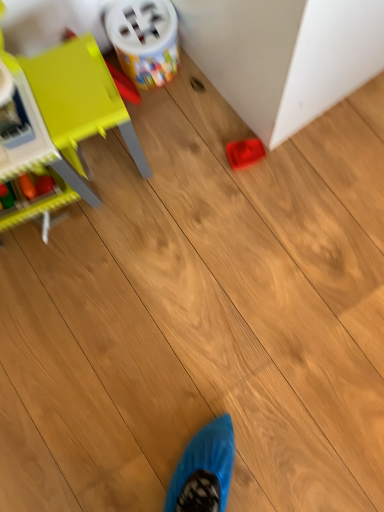
Measure the distance between matte yellow chair at left, which is the 3th toy in right-to-left order, and camera.

matte yellow chair at left, which is the 3th toy in right-to-left order, is 82.23 centimeters from camera.

How much space does matte plastic tray at center-right, the 3th toy when ordered from left to right, occupy horizontally?

matte plastic tray at center-right, the 3th toy when ordered from left to right, is 2.79 inches wide.

What do you see at coordinates (145, 40) in the screenshot? I see `plastic container at upper center, arranged as the second toy when viewed from the right` at bounding box center [145, 40].

Identify the location of matte yellow chair at left, which is the 3th toy in right-to-left order. (29, 132).

From the image's perspective, does matte plastic tray at center-right, the 3th toy when ordered from left to right, appear lower than matte yellow chair at left, which is the 3th toy in right-to-left order?

Actually, matte plastic tray at center-right, the 3th toy when ordered from left to right, appears above matte yellow chair at left, which is the 3th toy in right-to-left order, in the image.

Is matte plastic tray at center-right, arranged as the first toy when viewed from the right, looking in the opposite direction of matte yellow chair at left, the 1th toy in the left-to-right sequence?

matte plastic tray at center-right, arranged as the first toy when viewed from the right, is not turned away from matte yellow chair at left, the 1th toy in the left-to-right sequence.

What's the angular difference between matte plastic tray at center-right, the 3th toy when ordered from left to right, and matte yellow chair at left, the 1th toy in the left-to-right sequence,'s facing directions?

7.01 degrees separate the facing orientations of matte plastic tray at center-right, the 3th toy when ordered from left to right, and matte yellow chair at left, the 1th toy in the left-to-right sequence.

Is the depth of matte plastic tray at center-right, arranged as the first toy when viewed from the right, greater than that of matte yellow chair at left, the 1th toy in the left-to-right sequence?

Yes, matte plastic tray at center-right, arranged as the first toy when viewed from the right, is behind matte yellow chair at left, the 1th toy in the left-to-right sequence.

From a real-world perspective, who is located lower, matte yellow chair at left, the 1th toy in the left-to-right sequence, or matte plastic tray at center-right, the 3th toy when ordered from left to right?

From a 3D spatial view, matte plastic tray at center-right, the 3th toy when ordered from left to right, is below.

Does matte yellow chair at left, which is the 3th toy in right-to-left order, have a lesser height compared to matte plastic tray at center-right, arranged as the first toy when viewed from the right?

Incorrect, the height of matte yellow chair at left, which is the 3th toy in right-to-left order, does not fall short of that of matte plastic tray at center-right, arranged as the first toy when viewed from the right.

Which of these two, matte yellow chair at left, which is the 3th toy in right-to-left order, or matte plastic tray at center-right, arranged as the first toy when viewed from the right, is thinner?

With smaller width is matte plastic tray at center-right, arranged as the first toy when viewed from the right.

Between plastic container at upper center, arranged as the second toy when viewed from the right, and matte plastic tray at center-right, the 3th toy when ordered from left to right, which one appears on the left side from the viewer's perspective?

plastic container at upper center, arranged as the second toy when viewed from the right, is more to the left.

Is plastic container at upper center, acting as the second toy starting from the left, outside of matte plastic tray at center-right, arranged as the first toy when viewed from the right?

plastic container at upper center, acting as the second toy starting from the left, is positioned outside matte plastic tray at center-right, arranged as the first toy when viewed from the right.

From a real-world perspective, does plastic container at upper center, acting as the second toy starting from the left, sit lower than matte plastic tray at center-right, the 3th toy when ordered from left to right?

No, from a real-world perspective, plastic container at upper center, acting as the second toy starting from the left, is not beneath matte plastic tray at center-right, the 3th toy when ordered from left to right.

Is plastic container at upper center, arranged as the second toy when viewed from the right, next to matte plastic tray at center-right, the 3th toy when ordered from left to right?

plastic container at upper center, arranged as the second toy when viewed from the right, and matte plastic tray at center-right, the 3th toy when ordered from left to right, are clearly separated.

Which object is positioned more to the left, matte yellow chair at left, which is the 3th toy in right-to-left order, or plastic container at upper center, arranged as the second toy when viewed from the right?

From the viewer's perspective, matte yellow chair at left, which is the 3th toy in right-to-left order, appears more on the left side.

Who is smaller, matte yellow chair at left, which is the 3th toy in right-to-left order, or plastic container at upper center, acting as the second toy starting from the left?

plastic container at upper center, acting as the second toy starting from the left, is smaller.

Considering the points (29, 165) and (166, 62), which point is behind, point (29, 165) or point (166, 62)?

The point (166, 62) is more distant.

Where is `toy lying in front of the plastic container at upper center, arranged as the second toy when viewed from the right`? This screenshot has width=384, height=512. toy lying in front of the plastic container at upper center, arranged as the second toy when viewed from the right is located at coordinates (29, 132).

Is rubberized red tray at lower right in front of or behind matte yellow chair at left, which is the 3th toy in right-to-left order, in the image?

Visually, rubberized red tray at lower right is located behind matte yellow chair at left, which is the 3th toy in right-to-left order.

Which is more to the left, rubberized red tray at lower right or matte yellow chair at left, which is the 3th toy in right-to-left order?

Positioned to the left is matte yellow chair at left, which is the 3th toy in right-to-left order.

Who is smaller, rubberized red tray at lower right or matte yellow chair at left, the 1th toy in the left-to-right sequence?

Smaller between the two is matte yellow chair at left, the 1th toy in the left-to-right sequence.

Does point (276, 62) lie behind point (1, 170)?

No, (276, 62) is in front of (1, 170).

How distant is matte plastic tray at center-right, arranged as the first toy when viewed from the right, from rubberized red tray at lower right?

The distance of matte plastic tray at center-right, arranged as the first toy when viewed from the right, from rubberized red tray at lower right is 10.49 inches.

From the image's perspective, is matte plastic tray at center-right, the 3th toy when ordered from left to right, positioned above or below rubberized red tray at lower right?

Based on their image positions, matte plastic tray at center-right, the 3th toy when ordered from left to right, is located beneath rubberized red tray at lower right.

Is matte plastic tray at center-right, arranged as the first toy when viewed from the right, placed right next to rubberized red tray at lower right?

No, matte plastic tray at center-right, arranged as the first toy when viewed from the right, is not next to rubberized red tray at lower right.

Would you say matte plastic tray at center-right, arranged as the first toy when viewed from the right, is inside or outside rubberized red tray at lower right?

matte plastic tray at center-right, arranged as the first toy when viewed from the right, cannot be found inside rubberized red tray at lower right.

Is the position of rubberized red tray at lower right more distant than that of plastic container at upper center, arranged as the second toy when viewed from the right?

No, rubberized red tray at lower right is closer to the camera.

Do you think rubberized red tray at lower right is within plastic container at upper center, acting as the second toy starting from the left, or outside of it?

rubberized red tray at lower right is outside plastic container at upper center, acting as the second toy starting from the left.

From the image's perspective, relative to plastic container at upper center, acting as the second toy starting from the left, is rubberized red tray at lower right above or below?

Based on their image positions, rubberized red tray at lower right is located above plastic container at upper center, acting as the second toy starting from the left.

From a real-world perspective, is rubberized red tray at lower right located beneath plastic container at upper center, acting as the second toy starting from the left?

Incorrect, from a real-world perspective, rubberized red tray at lower right is higher than plastic container at upper center, acting as the second toy starting from the left.

From the image's perspective, which toy is the 1st one above the matte yellow chair at left, which is the 3th toy in right-to-left order? Please provide its 2D coordinates.

[(244, 153)]

Locate an element on the screen. The height and width of the screenshot is (512, 384). the 2nd toy counting from the left of the matte plastic tray at center-right, arranged as the first toy when viewed from the right is located at coordinates (29, 132).

Based on the photo, based on their spatial positions, is matte yellow chair at left, the 1th toy in the left-to-right sequence, or matte plastic tray at center-right, arranged as the first toy when viewed from the right, closer to rubberized red tray at lower right?

matte plastic tray at center-right, arranged as the first toy when viewed from the right, lies closer to rubberized red tray at lower right than the other object.

From the image, which object appears to be farther from plastic container at upper center, arranged as the second toy when viewed from the right, matte yellow chair at left, the 1th toy in the left-to-right sequence, or matte plastic tray at center-right, the 3th toy when ordered from left to right?

matte yellow chair at left, the 1th toy in the left-to-right sequence, lies further to plastic container at upper center, arranged as the second toy when viewed from the right, than the other object.

From the image, which object appears to be farther from rubberized red tray at lower right, matte plastic tray at center-right, the 3th toy when ordered from left to right, or plastic container at upper center, arranged as the second toy when viewed from the right?

Among the two, plastic container at upper center, arranged as the second toy when viewed from the right, is located further to rubberized red tray at lower right.

Based on their spatial positions, is rubberized red tray at lower right or plastic container at upper center, arranged as the second toy when viewed from the right, further from matte plastic tray at center-right, the 3th toy when ordered from left to right?

The object further to matte plastic tray at center-right, the 3th toy when ordered from left to right, is plastic container at upper center, arranged as the second toy when viewed from the right.

Estimate the real-world distances between objects in this image. Which object is closer to rubberized red tray at lower right, matte plastic tray at center-right, the 3th toy when ordered from left to right, or matte yellow chair at left, the 1th toy in the left-to-right sequence?

matte plastic tray at center-right, the 3th toy when ordered from left to right, is closer to rubberized red tray at lower right.

Looking at the image, which one is located further to plastic container at upper center, arranged as the second toy when viewed from the right, rubberized red tray at lower right or matte plastic tray at center-right, the 3th toy when ordered from left to right?

matte plastic tray at center-right, the 3th toy when ordered from left to right.

Based on the photo, which object lies nearer to the anchor point rubberized red tray at lower right, plastic container at upper center, acting as the second toy starting from the left, or matte plastic tray at center-right, arranged as the first toy when viewed from the right?

The object closer to rubberized red tray at lower right is matte plastic tray at center-right, arranged as the first toy when viewed from the right.

When comparing their distances from matte yellow chair at left, the 1th toy in the left-to-right sequence, does matte plastic tray at center-right, arranged as the first toy when viewed from the right, or rubberized red tray at lower right seem further?

rubberized red tray at lower right is positioned further to the anchor matte yellow chair at left, the 1th toy in the left-to-right sequence.

At what (x,y) coordinates should I click in order to perform the action: click on toy between matte yellow chair at left, which is the 3th toy in right-to-left order, and matte plastic tray at center-right, the 3th toy when ordered from left to right, from front to back. Please return your answer as a coordinate pair (x, y). Looking at the image, I should click on (145, 40).

I want to click on furniture between matte yellow chair at left, which is the 3th toy in right-to-left order, and matte plastic tray at center-right, arranged as the first toy when viewed from the right, from front to back, so click(x=283, y=55).

Where is `toy between rubberized red tray at lower right and matte plastic tray at center-right, the 3th toy when ordered from left to right, in the front-back direction`? This screenshot has height=512, width=384. toy between rubberized red tray at lower right and matte plastic tray at center-right, the 3th toy when ordered from left to right, in the front-back direction is located at coordinates (145, 40).